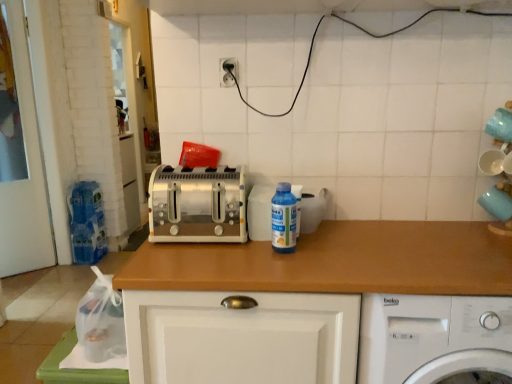
Question: Can you confirm if wooden at center is taller than white plastic electric outlet at upper center?

Choices:
 (A) yes
 (B) no

Answer: (A)

Question: Does wooden at center contain white plastic electric outlet at upper center?

Choices:
 (A) yes
 (B) no

Answer: (B)

Question: Is wooden at center placed right next to white plastic electric outlet at upper center?

Choices:
 (A) no
 (B) yes

Answer: (A)

Question: Can you confirm if wooden at center is bigger than white plastic electric outlet at upper center?

Choices:
 (A) no
 (B) yes

Answer: (B)

Question: From a real-world perspective, is wooden at center on white plastic electric outlet at upper center?

Choices:
 (A) yes
 (B) no

Answer: (B)

Question: Based on their positions, is transparent plastic bottle at center located to the left or right of white plastic washing machine at lower right?

Choices:
 (A) right
 (B) left

Answer: (B)

Question: Is transparent plastic bottle at center taller or shorter than white plastic washing machine at lower right?

Choices:
 (A) tall
 (B) short

Answer: (B)

Question: Is point (287, 236) closer or farther from the camera than point (388, 296)?

Choices:
 (A) farther
 (B) closer

Answer: (A)

Question: Looking at their shapes, would you say transparent plastic bottle at center is wider or thinner than white plastic washing machine at lower right?

Choices:
 (A) wide
 (B) thin

Answer: (B)

Question: Looking at the image, does wooden at center seem bigger or smaller compared to transparent plastic bottle at center?

Choices:
 (A) big
 (B) small

Answer: (A)

Question: Looking at their shapes, would you say wooden at center is wider or thinner than transparent plastic bottle at center?

Choices:
 (A) thin
 (B) wide

Answer: (B)

Question: From a real-world perspective, is wooden at center physically located above or below transparent plastic bottle at center?

Choices:
 (A) below
 (B) above

Answer: (A)

Question: Is wooden at center to the left or to the right of transparent plastic bottle at center in the image?

Choices:
 (A) left
 (B) right

Answer: (A)

Question: From a real-world perspective, is transparent plastic bottle at center physically located above or below wooden at center?

Choices:
 (A) above
 (B) below

Answer: (A)

Question: In terms of height, does transparent plastic bottle at center look taller or shorter compared to wooden at center?

Choices:
 (A) tall
 (B) short

Answer: (B)